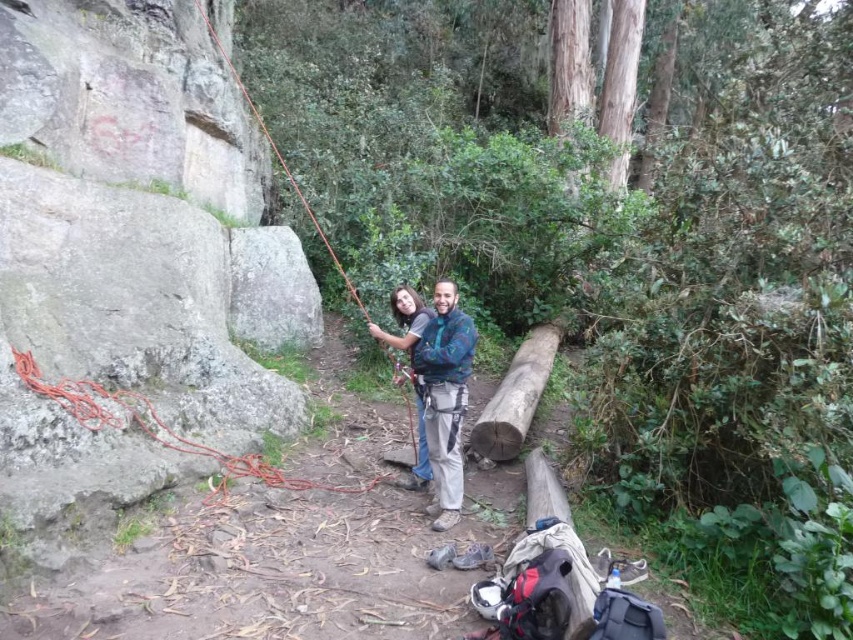
Question: Can you confirm if orange rope at left is thinner than smooth brown log at center?

Choices:
 (A) no
 (B) yes

Answer: (A)

Question: From the image, what is the correct spatial relationship of blue patterned shirt at center in relation to smooth brown log at center?

Choices:
 (A) above
 (B) below

Answer: (B)

Question: Which object is positioned closest to the orange rope at left?

Choices:
 (A) blue patterned shirt at center
 (B) smooth brown log at center

Answer: (A)

Question: Is orange rope at left further to camera compared to smooth brown log at center?

Choices:
 (A) yes
 (B) no

Answer: (B)

Question: Considering the real-world distances, which object is closest to the smooth brown log at center?

Choices:
 (A) blue patterned shirt at center
 (B) orange rope at left

Answer: (A)

Question: Estimate the real-world distances between objects in this image. Which object is closer to the orange rope at left?

Choices:
 (A) blue patterned shirt at center
 (B) smooth brown log at center

Answer: (A)